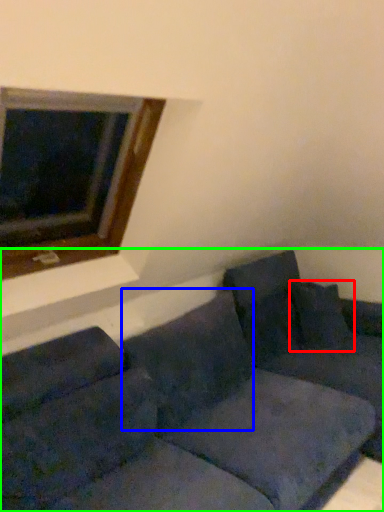
Question: Which is farther away from pillow (highlighted by a red box)? pillow (highlighted by a blue box) or studio couch (highlighted by a green box)?

Choices:
 (A) pillow
 (B) studio couch

Answer: (A)